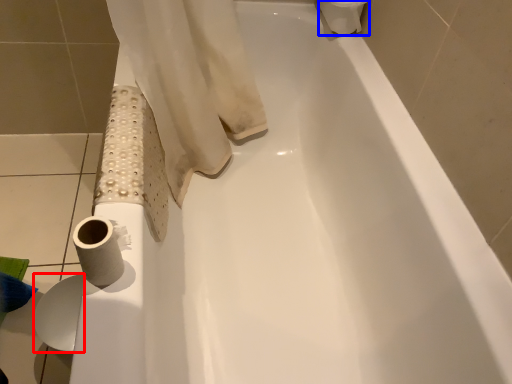
Question: Which of the following is the closest to the observer, toilet paper (highlighted by a red box) or toilet paper (highlighted by a blue box)?

Choices:
 (A) toilet paper
 (B) toilet paper

Answer: (A)